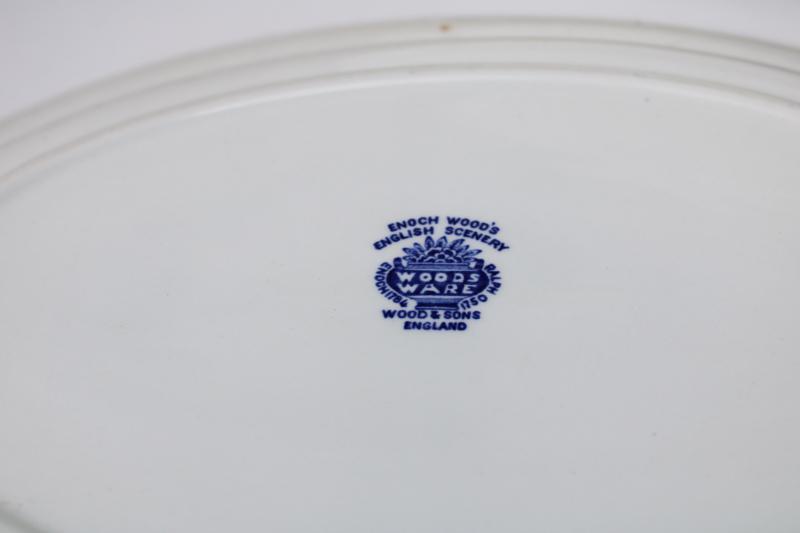
The width and height of the screenshot is (800, 533). I want to click on white plate, so click(x=230, y=4), click(x=650, y=367).